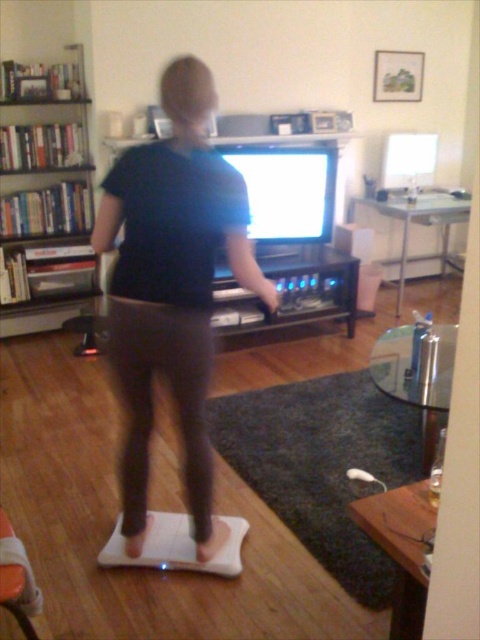
You are a delivery person who just arrived at the address to drop off a new white rubber mat. The homeowner mentioned they already have a wooden bookshelf at left. Based on the scene, will the new white rubber mat at lower center fit in the space where the old one was?

The white rubber mat at lower center has a larger size compared to wooden bookshelf at left. Since the new mat is larger than the existing bookshelf, it might not fit in the space where the old mat was placed unless the area can accommodate its increased size.

Consider the image. You are trying to place a new poster on the wall between the white rubber mat at lower center and the wooden bookshelf at left. Which object should you stand closer to in order to reach the poster easily?

The white rubber mat at lower center is shorter than the wooden bookshelf at left, so you should stand closer to the white rubber mat at lower center to reach the poster easily.

You are a delivery person who needs to place a small package between the black matte shirt at center and the black wood entertainment center at center. The package requires 1.5 meters of space. Can you fit it there?

The distance between the black matte shirt at center and the black wood entertainment center at center is 1.60 meters, so yes, the package requiring 1.5 meters of space can fit in that area.